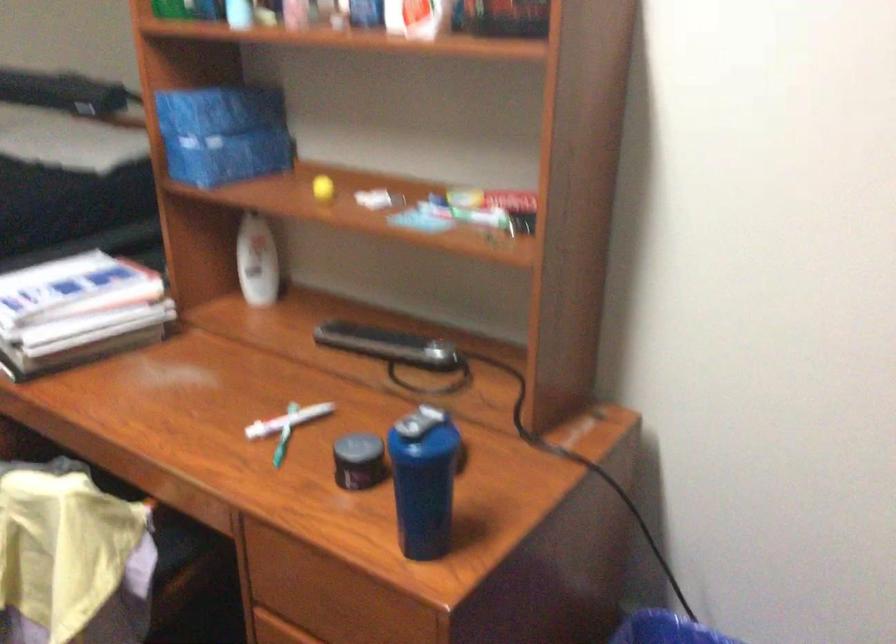
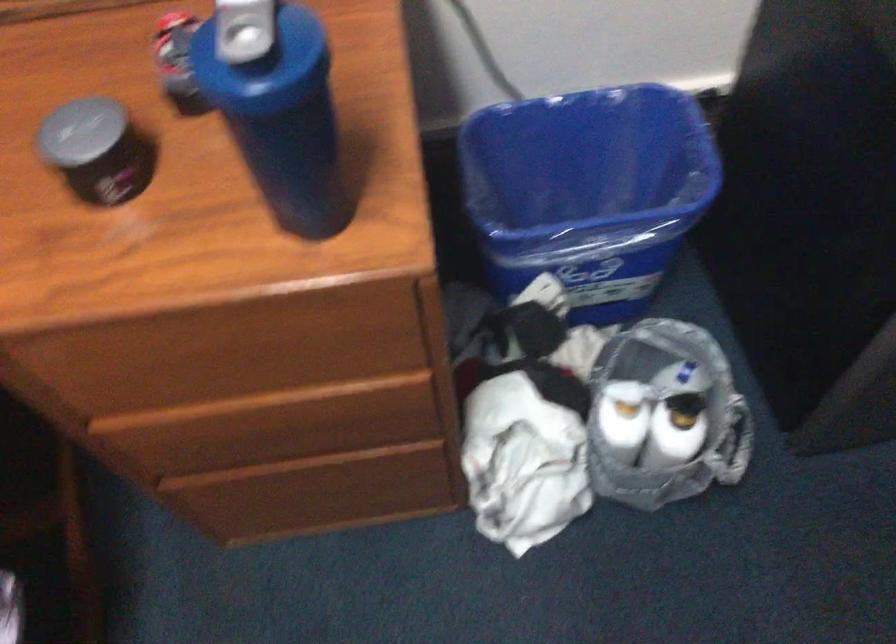
Where in the second image is the point corresponding to point 405,457 from the first image?

(264, 102)